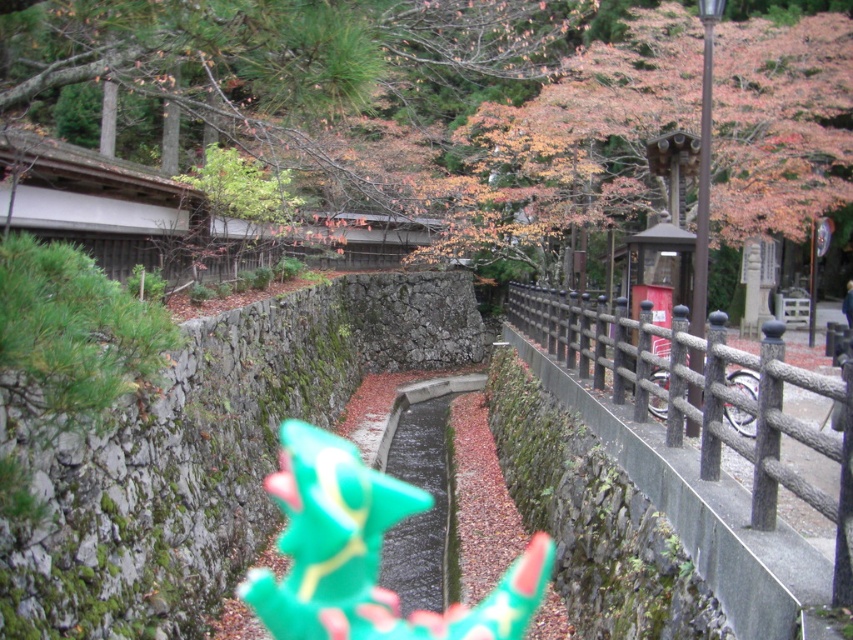
You are a visitor at a traditional Japanese temple during autumn. You notice autumn leaves at upper center and a green plastic toy at center. Which object is higher up in the image?

The autumn leaves at upper center are positioned over the green plastic toy at center, so they are higher up in the image.

You are a visitor at the temple and want to take a photo of the smooth gray fence at center right and the green plastic toy at center. Which object should you focus on first if you want to include both in your photo without moving the camera?

The smooth gray fence at center right is larger in size than the green plastic toy at center, so you should focus on the green plastic toy at center first to ensure both fit in the frame.

You are a visitor at the temple and want to take a photo of the autumn leaves at upper center and the smooth gray fence at center right. Which object appears taller in the photo?

The autumn leaves at upper center appears taller than the smooth gray fence at center right in the photo.